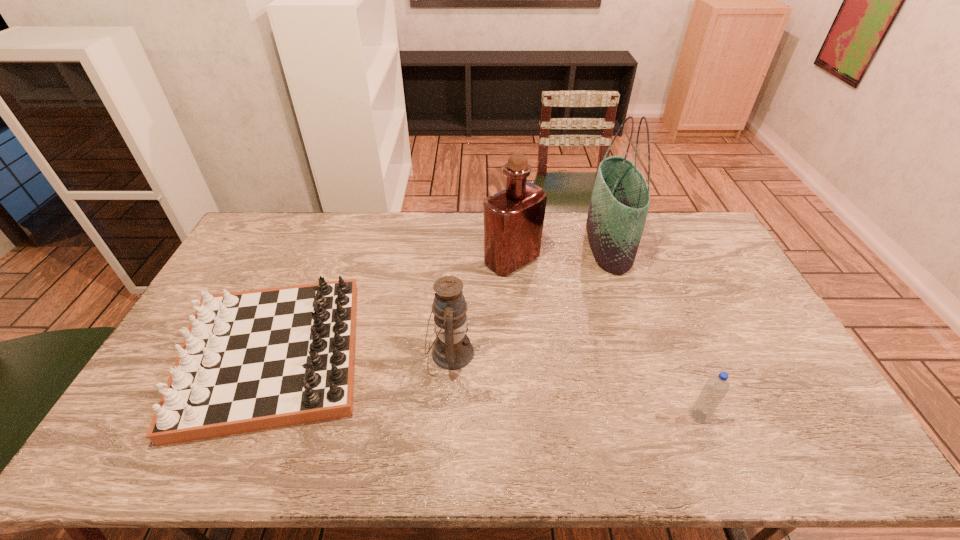
You are a GUI agent. You are given a task and a screenshot of the screen. Output one action in this format:
    pyautogui.click(x=<x>, y=<y>)
    Task: Click on the free spot between the third object from left to right and the tallest object
    
    Given the screenshot: What is the action you would take?
    pyautogui.click(x=560, y=253)

Identify the location of empty space between the leftmost object and the third tallest object. (362, 355).

You are a GUI agent. You are given a task and a screenshot of the screen. Output one action in this format:
    pyautogui.click(x=<x>, y=<y>)
    Task: Click on the blank region between the oil lamp and the gameboard
    
    Given the screenshot: What is the action you would take?
    362,355

Point out which object is positioned as the second nearest to the gameboard. Please provide its 2D coordinates. Your answer should be formatted as a tuple, i.e. [(x, y)], where the tuple contains the x and y coordinates of a point satisfying the conditions above.

[(513, 218)]

Select which object is the second closest to the second tallest object. Please provide its 2D coordinates. Your answer should be formatted as a tuple, i.e. [(x, y)], where the tuple contains the x and y coordinates of a point satisfying the conditions above.

[(452, 350)]

Image resolution: width=960 pixels, height=540 pixels. I want to click on free spot that satisfies the following two spatial constraints: 1. on the back side of the leftmost object; 2. on the right side of the third object from left to right, so click(313, 260).

Find the location of a particular element. vacant space that satisfies the following two spatial constraints: 1. on the back side of the gameboard; 2. on the right side of the second tallest object is located at coordinates point(313,260).